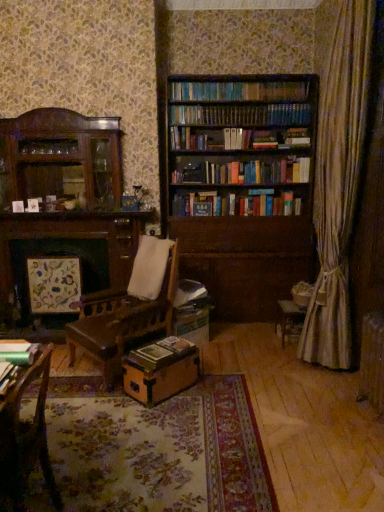
Image resolution: width=384 pixels, height=512 pixels. Describe the element at coordinates (26, 436) in the screenshot. I see `wooden chair at lower left` at that location.

The width and height of the screenshot is (384, 512). What do you see at coordinates (243, 186) in the screenshot?
I see `brown wooden bookcase at center` at bounding box center [243, 186].

Describe the element at coordinates (160, 370) in the screenshot. I see `brown cardboard box at center` at that location.

The height and width of the screenshot is (512, 384). Describe the element at coordinates (161, 353) in the screenshot. I see `hardcover book at center, which is the 2th book in left-to-right order` at that location.

Describe the element at coordinates (14, 360) in the screenshot. I see `metallic green book at lower left, the 2th book from the right` at that location.

Where is `wooden chair at lower left`? The image size is (384, 512). wooden chair at lower left is located at coordinates (26, 436).

Would you consider metallic green book at lower left, which ranks as the 1th book in left-to-right order, to be distant from hardcover book at center, which is the second book from top to bottom?

metallic green book at lower left, which ranks as the 1th book in left-to-right order, is far away from hardcover book at center, which is the second book from top to bottom.

Does point (23, 348) come closer to viewer compared to point (160, 351)?

Yes.

From the image's perspective, is metallic green book at lower left, the 2th book from the right, located above hardcover book at center, which is the 2th book in left-to-right order?

Yes, from the image's perspective, metallic green book at lower left, the 2th book from the right, is above hardcover book at center, which is the 2th book in left-to-right order.

The width and height of the screenshot is (384, 512). I want to click on book that appears on the left of hardcover book at center, which appears as the first book when ordered from the bottom, so click(x=14, y=360).

Is brown cardboard box at center bigger or smaller than wooden chair at lower left?

In the image, brown cardboard box at center appears to be smaller than wooden chair at lower left.

Is wooden chair at lower left at the back of brown cardboard box at center?

brown cardboard box at center does not have its back to wooden chair at lower left.

Is brown cardboard box at center wider or thinner than wooden chair at lower left?

brown cardboard box at center is wider than wooden chair at lower left.

From the image's perspective, is brown cardboard box at center over wooden chair at lower left?

Incorrect, from the image's perspective, brown cardboard box at center is lower than wooden chair at lower left.

Identify the location of bookcase on the right of the metallic green book at lower left, which ranks as the 1th book in left-to-right order. (243, 186).

From the image's perspective, is metallic green book at lower left, arranged as the first book when viewed from the top, under brown wooden bookcase at center?

Correct, metallic green book at lower left, arranged as the first book when viewed from the top, appears lower than brown wooden bookcase at center in the image.

Is metallic green book at lower left, arranged as the first book when viewed from the top, not within brown wooden bookcase at center?

Yes, metallic green book at lower left, arranged as the first book when viewed from the top, is located beyond the bounds of brown wooden bookcase at center.

How far apart are metallic green book at lower left, arranged as the first book when viewed from the top, and brown wooden bookcase at center?

The distance of metallic green book at lower left, arranged as the first book when viewed from the top, from brown wooden bookcase at center is 9.37 feet.

Can brown cardboard box at center be found inside wooden chair at lower left?

Definitely not — brown cardboard box at center is not inside wooden chair at lower left.

Can you confirm if wooden chair at lower left is shorter than brown cardboard box at center?

No.

Is wooden chair at lower left to the left or to the right of brown cardboard box at center in the image?

wooden chair at lower left is to the left of brown cardboard box at center.

How different are the orientations of wooden chair at lower left and brown cardboard box at center in degrees?

The angle between the facing direction of wooden chair at lower left and the facing direction of brown cardboard box at center is 45.7 degrees.

Where is `the 2nd book above when counting from the brown cardboard box at center (from the image's perspective)`? the 2nd book above when counting from the brown cardboard box at center (from the image's perspective) is located at coordinates (14, 360).

Is the surface of metallic green book at lower left, the first book positioned from the front, in direct contact with brown cardboard box at center?

There is a gap between metallic green book at lower left, the first book positioned from the front, and brown cardboard box at center.

Is metallic green book at lower left, which ranks as the 1th book in left-to-right order, inside the boundaries of brown cardboard box at center, or outside?

metallic green book at lower left, which ranks as the 1th book in left-to-right order, is located beyond the bounds of brown cardboard box at center.

Which object is closer to the camera, metallic green book at lower left, the 2th book from the right, or brown cardboard box at center?

Positioned in front is metallic green book at lower left, the 2th book from the right.

Is brown wooden bookcase at center positioned far away from hardcover book at center, which is the 2th book in left-to-right order?

That's right, there is a large distance between brown wooden bookcase at center and hardcover book at center, which is the 2th book in left-to-right order.

Consider the image. What's the angular difference between brown wooden bookcase at center and hardcover book at center, arranged as the 1th book when viewed from the back,'s facing directions?

45.6 degrees.

Considering the points (268, 277) and (187, 345), which point is in front, point (268, 277) or point (187, 345)?

Point (187, 345)

Is brown wooden bookcase at center aimed at hardcover book at center, which is counted as the first book, starting from the right?

Yes.

Does hardcover book at center, which is the second book from top to bottom, lie in front of brown cardboard box at center?

No, it is behind brown cardboard box at center.

From a real-world perspective, which object rests below the other?

From a 3D spatial view, brown cardboard box at center is below.

Measure the distance from hardcover book at center, which is counted as the first book, starting from the right, to brown cardboard box at center.

A distance of 2.18 inches exists between hardcover book at center, which is counted as the first book, starting from the right, and brown cardboard box at center.

Identify the location of book that appears on the left of hardcover book at center, the second book positioned from the front. Image resolution: width=384 pixels, height=512 pixels. (14, 360).

Image resolution: width=384 pixels, height=512 pixels. I want to click on chair lying in front of the brown cardboard box at center, so click(26, 436).

When comparing their distances from brown wooden bookcase at center, does hardcover book at center, arranged as the 1th book when viewed from the back, or metallic green book at lower left, placed as the second book when sorted from back to front, seem closer?

Based on the image, hardcover book at center, arranged as the 1th book when viewed from the back, appears to be nearer to brown wooden bookcase at center.

Looking at the image, which one is located closer to wooden chair at lower left, metallic green book at lower left, the first book positioned from the front, or brown cardboard box at center?

Based on the image, metallic green book at lower left, the first book positioned from the front, appears to be nearer to wooden chair at lower left.

Based on their spatial positions, is brown wooden bookcase at center or metallic green book at lower left, the first book positioned from the front, further from wooden chair at lower left?

brown wooden bookcase at center is positioned further to the anchor wooden chair at lower left.

Considering their positions, is brown wooden bookcase at center positioned closer to metallic green book at lower left, placed as the second book when sorted from back to front, than brown cardboard box at center?

brown cardboard box at center is closer to metallic green book at lower left, placed as the second book when sorted from back to front.

Based on their spatial positions, is brown wooden bookcase at center or wooden chair at lower left further from brown cardboard box at center?

Among the two, brown wooden bookcase at center is located further to brown cardboard box at center.

When comparing their distances from hardcover book at center, which appears as the first book when ordered from the bottom, does wooden chair at lower left or brown wooden bookcase at center seem closer?

wooden chair at lower left is closer to hardcover book at center, which appears as the first book when ordered from the bottom.

Which object lies further to the anchor point wooden chair at lower left, brown cardboard box at center or metallic green book at lower left, which ranks as the 1th book in left-to-right order?

brown cardboard box at center is positioned further to the anchor wooden chair at lower left.

From the image, which object appears to be nearer to brown cardboard box at center, metallic green book at lower left, placed as the second book when sorted from back to front, or brown wooden bookcase at center?

metallic green book at lower left, placed as the second book when sorted from back to front, is positioned closer to the anchor brown cardboard box at center.

Locate an element on the screen. cardboard box between wooden chair at lower left and brown wooden bookcase at center along the z-axis is located at coordinates (160, 370).

Image resolution: width=384 pixels, height=512 pixels. Identify the location of cardboard box between metallic green book at lower left, the 2th book from the right, and brown wooden bookcase at center from front to back. (160, 370).

The image size is (384, 512). I want to click on book between wooden chair at lower left and brown cardboard box at center in the front-back direction, so click(x=14, y=360).

This screenshot has height=512, width=384. What are the coordinates of `cardboard box between wooden chair at lower left and hardcover book at center, which is the second book from top to bottom, in the front-back direction` in the screenshot? It's located at pyautogui.click(x=160, y=370).